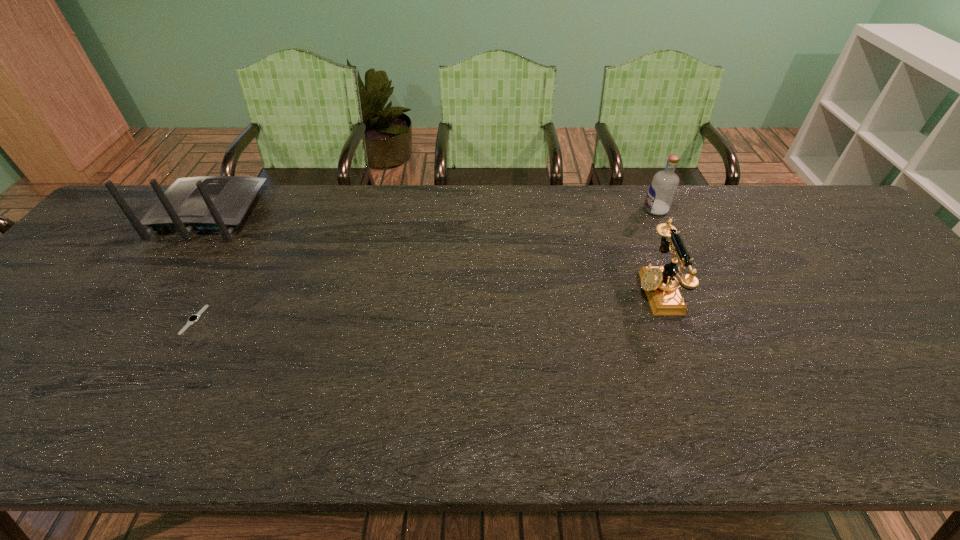
The height and width of the screenshot is (540, 960). I want to click on vacant space in between the telephone and the router, so click(x=433, y=252).

I want to click on free space between the watch and the router, so click(x=202, y=266).

Locate an element on the screen. vacant space that's between the watch and the vodka is located at coordinates (425, 265).

Where is `free space between the telephone and the vodka`? The height and width of the screenshot is (540, 960). free space between the telephone and the vodka is located at coordinates (657, 251).

Locate an element on the screen. This screenshot has height=540, width=960. free spot between the third object from left to right and the shortest object is located at coordinates (425, 306).

Find the location of a particular element. vacant point located between the router and the vodka is located at coordinates (432, 211).

Image resolution: width=960 pixels, height=540 pixels. Identify the location of vacant area that lies between the vodka and the router. (432, 211).

Locate an element on the screen. The image size is (960, 540). empty space that is in between the rightmost object and the shortest object is located at coordinates (425, 265).

At what (x,y) coordinates should I click in order to perform the action: click on blank region between the shortest object and the third object from left to right. Please return your answer as a coordinate pair (x, y). The width and height of the screenshot is (960, 540). Looking at the image, I should click on 425,306.

Find the location of a particular element. unoccupied area between the router and the telephone is located at coordinates (433, 252).